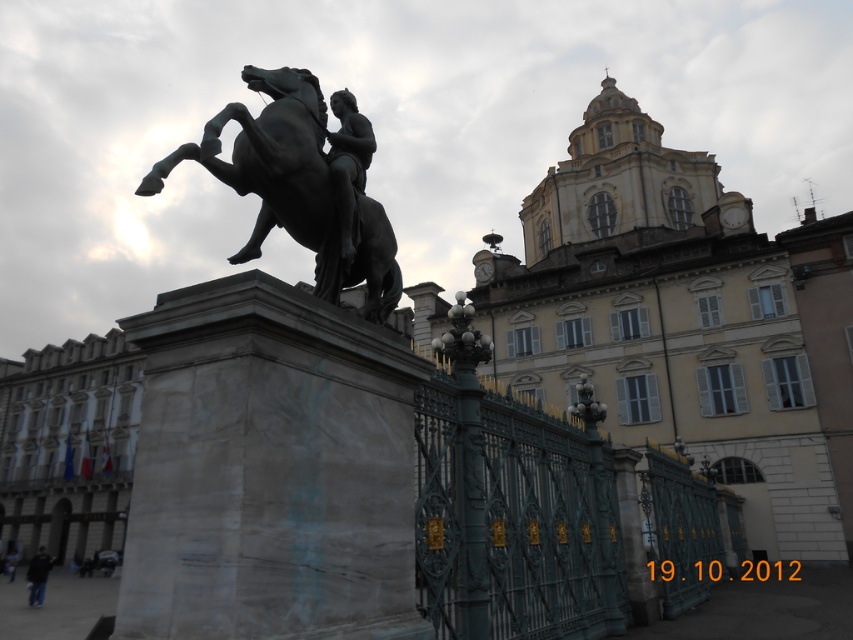
Question: Which of these objects is positioned closest to the yellow stone building at upper center?

Choices:
 (A) polished bronze statue at center
 (B) green wrought iron fence at center
 (C) dark gray jacket at lower left
 (D) black polished statue at center

Answer: (B)

Question: Which point is farther to the camera?

Choices:
 (A) (337, 195)
 (B) (727, 330)

Answer: (B)

Question: Is yellow stone building at upper center above green wrought iron fence at center?

Choices:
 (A) yes
 (B) no

Answer: (A)

Question: Estimate the real-world distances between objects in this image. Which object is farther from the green wrought iron fence at center?

Choices:
 (A) yellow stone building at upper center
 (B) black polished statue at center
 (C) polished bronze statue at center

Answer: (A)

Question: Is the position of green wrought iron fence at center more distant than that of dark gray jacket at lower left?

Choices:
 (A) yes
 (B) no

Answer: (B)

Question: Can you confirm if black polished statue at center is smaller than dark gray jacket at lower left?

Choices:
 (A) no
 (B) yes

Answer: (B)